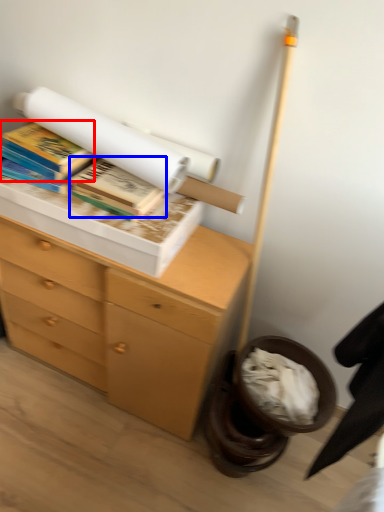
Question: Among these objects, which one is farthest to the camera, book (highlighted by a red box) or book (highlighted by a blue box)?

Choices:
 (A) book
 (B) book

Answer: (A)